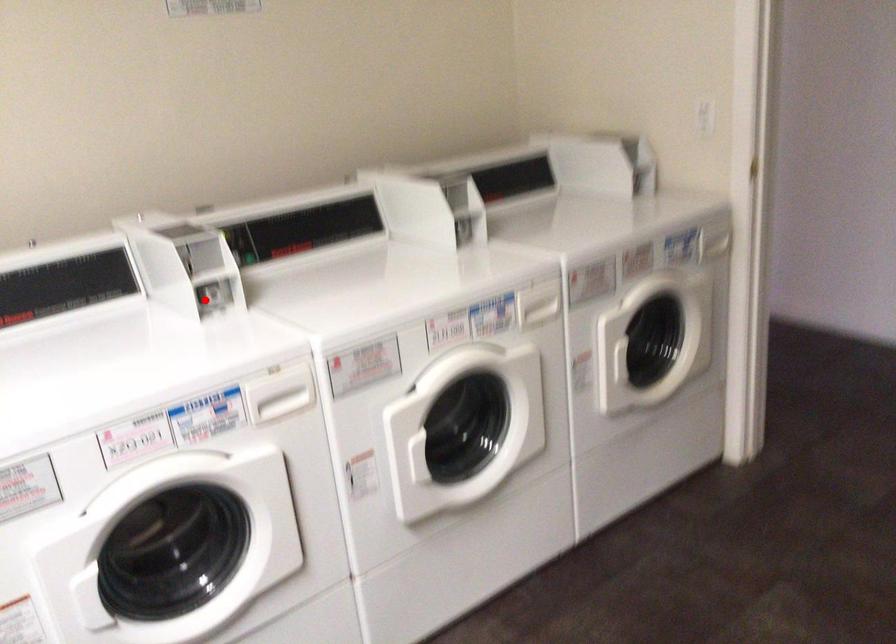
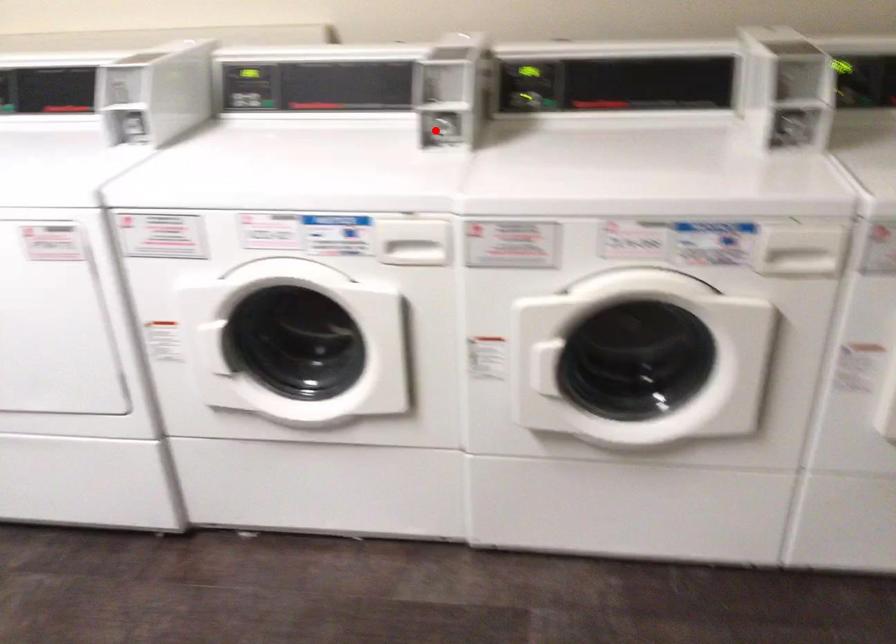
I am providing you with two images of the same scene from different viewpoints. A red point is marked on the first image and another point is marked on the second image. Is the red point in image1 aligned with the point shown in image2?

Yes